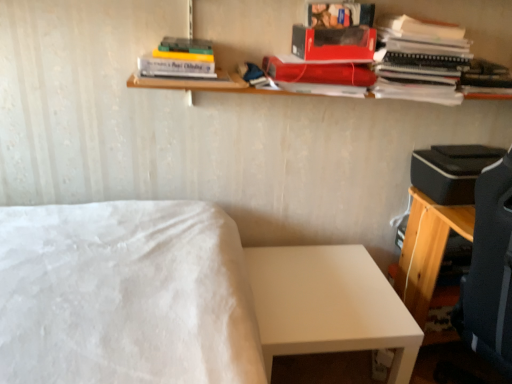
Question: Is white matte bed at center located within shiny red paperback book at upper center, which is counted as the second paperback book, starting from the top?

Choices:
 (A) no
 (B) yes

Answer: (A)

Question: Is shiny red paperback book at upper center, which is counted as the second paperback book, starting from the top, to the right of white matte bed at center from the viewer's perspective?

Choices:
 (A) no
 (B) yes

Answer: (B)

Question: Are shiny red paperback book at upper center, marked as the 2th paperback book in a bottom-to-top arrangement, and white matte bed at center far apart?

Choices:
 (A) no
 (B) yes

Answer: (A)

Question: Is shiny red paperback book at upper center, which is counted as the second paperback book, starting from the top, directly adjacent to white matte bed at center?

Choices:
 (A) no
 (B) yes

Answer: (A)

Question: Can you confirm if shiny red paperback book at upper center, marked as the 2th paperback book in a bottom-to-top arrangement, is thinner than white matte bed at center?

Choices:
 (A) no
 (B) yes

Answer: (B)

Question: In terms of size, does shiny red paperback book at upper center, which is counted as the second paperback book, starting from the top, appear bigger or smaller than matte black notebook at upper right, placed as the first book when sorted from right to left?

Choices:
 (A) big
 (B) small

Answer: (B)

Question: Based on their positions, is shiny red paperback book at upper center, which is counted as the second paperback book, starting from the top, located to the left or right of matte black notebook at upper right, placed as the first book when sorted from right to left?

Choices:
 (A) left
 (B) right

Answer: (A)

Question: From the image's perspective, is shiny red paperback book at upper center, which is counted as the second paperback book, starting from the top, above or below matte black notebook at upper right, marked as the third book in a left-to-right arrangement?

Choices:
 (A) above
 (B) below

Answer: (B)

Question: From their relative heights in the image, would you say shiny red paperback book at upper center, which is counted as the second paperback book, starting from the top, is taller or shorter than matte black notebook at upper right, marked as the third book in a left-to-right arrangement?

Choices:
 (A) short
 (B) tall

Answer: (A)

Question: Considering the positions of matte red book at upper right, arranged as the 2th book when viewed from the right, and white matte table at lower right in the image, is matte red book at upper right, arranged as the 2th book when viewed from the right, wider or thinner than white matte table at lower right?

Choices:
 (A) thin
 (B) wide

Answer: (A)

Question: Does point (390, 16) appear closer or farther from the camera than point (362, 256)?

Choices:
 (A) closer
 (B) farther

Answer: (A)

Question: From a real-world perspective, relative to white matte table at lower right, is matte red book at upper right, arranged as the 2th book when viewed from the right, vertically above or below?

Choices:
 (A) above
 (B) below

Answer: (A)

Question: From the image's perspective, is matte red book at upper right, arranged as the 2th book when viewed from the right, located above or below white matte table at lower right?

Choices:
 (A) above
 (B) below

Answer: (A)

Question: In terms of size, does matte red paperback book at upper center, which is counted as the third paperback book, starting from the bottom, appear bigger or smaller than white matte table at lower right?

Choices:
 (A) big
 (B) small

Answer: (B)

Question: Is matte red paperback book at upper center, which is counted as the third paperback book, starting from the bottom, in front of or behind white matte table at lower right in the image?

Choices:
 (A) behind
 (B) front

Answer: (A)